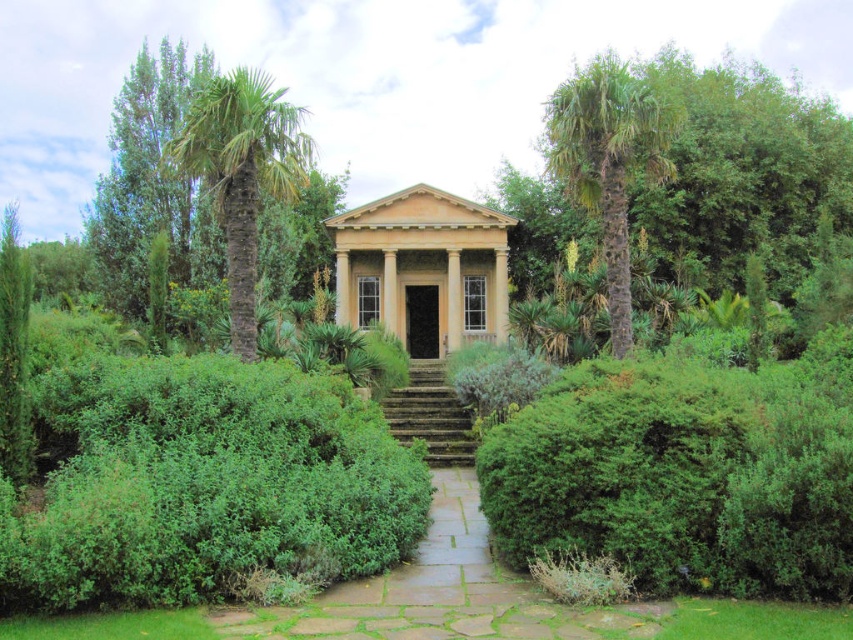
Question: Does green leafy hedge at center have a lesser width compared to stone steps at center?

Choices:
 (A) no
 (B) yes

Answer: (A)

Question: Among these objects, which one is nearest to the camera?

Choices:
 (A) green textured palm tree at left
 (B) beige stone gazebo at center
 (C) green leafy hedge at center

Answer: (C)

Question: Which of the following is the closest to the observer?

Choices:
 (A) stone steps at center
 (B) green textured palm tree at right
 (C) green textured palm tree at left
 (D) green leafy hedge at center

Answer: (D)

Question: Which object is the farthest from the green textured palm tree at left?

Choices:
 (A) stone steps at center
 (B) green leafy hedge at center

Answer: (B)

Question: Is green leafy hedge at center above green textured palm tree at right?

Choices:
 (A) yes
 (B) no

Answer: (B)

Question: Is beige stone gazebo at center below green textured palm tree at left?

Choices:
 (A) no
 (B) yes

Answer: (B)